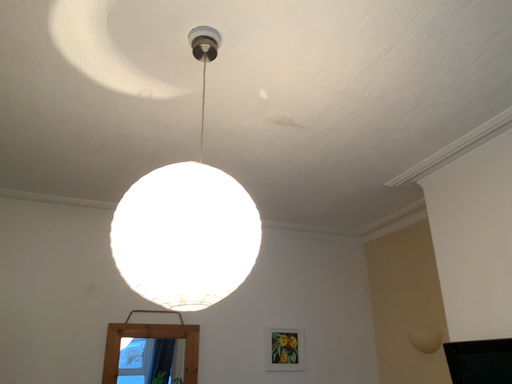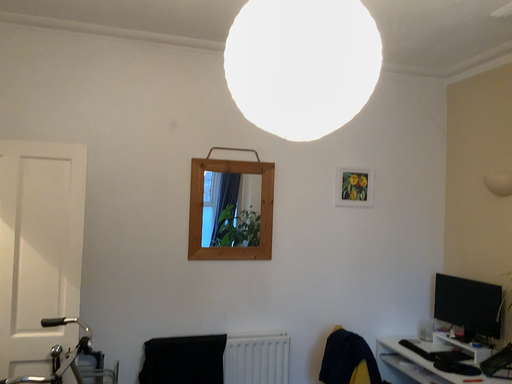
Question: How did the camera likely rotate when shooting the video?

Choices:
 (A) rotated upward
 (B) rotated downward

Answer: (B)